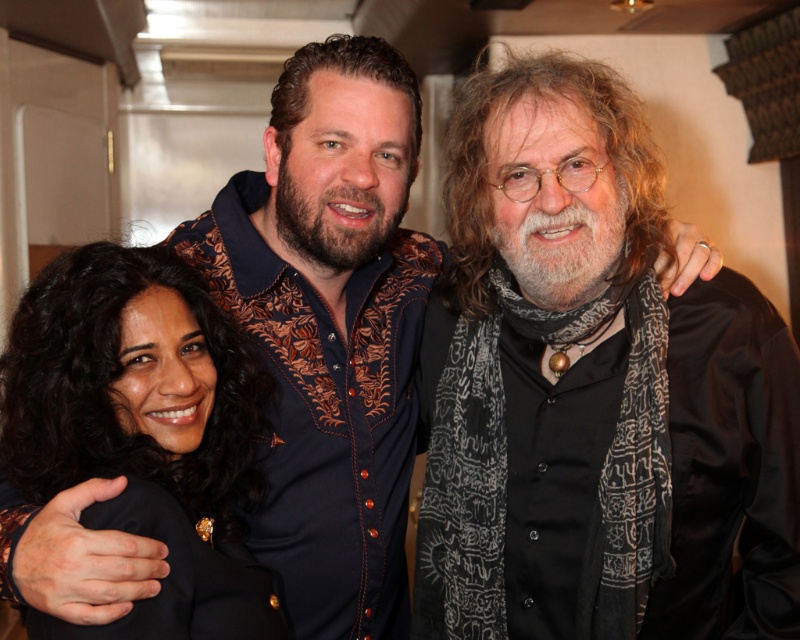
Who is taller, black satin shirt at center or black satin jacket at lower left?

With more height is black satin shirt at center.

Who is lower down, black satin shirt at center or black satin jacket at lower left?

A: black satin jacket at lower left

Is point (754, 609) behind point (118, 371)?

Yes, point (754, 609) is farther from viewer.

In order to click on black satin shirt at center in this screenshot , I will do `click(592, 388)`.